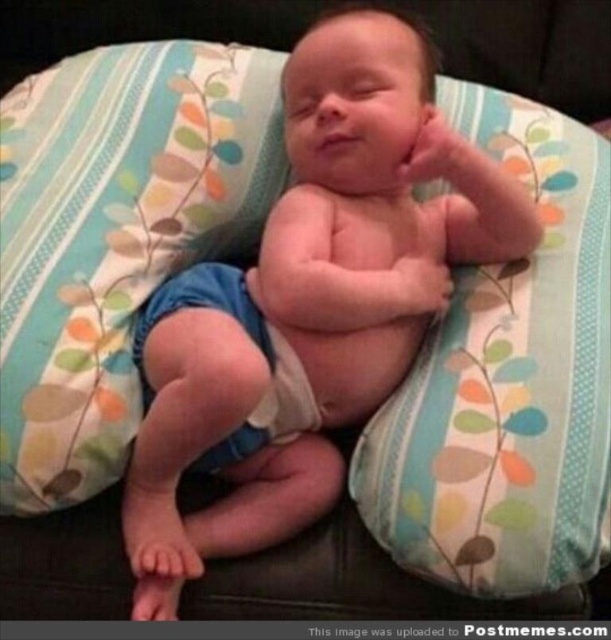
Can you confirm if smooth skin baby at center is smaller than blue fabric diaper at center?

No.

Is smooth skin baby at center wider than blue fabric diaper at center?

Correct, the width of smooth skin baby at center exceeds that of blue fabric diaper at center.

Is point (137, 552) farther from viewer compared to point (290, 356)?

That is False.

The width and height of the screenshot is (611, 640). I want to click on smooth skin baby at center, so click(309, 301).

Can you confirm if smooth skin baby at center is shorter than blue fabric pillow at center?

No.

Who is taller, smooth skin baby at center or blue fabric pillow at center?

Standing taller between the two is smooth skin baby at center.

At what (x,y) coordinates should I click in order to perform the action: click on smooth skin baby at center. Please return your answer as a coordinate pair (x, y). Looking at the image, I should click on (309, 301).

Can you confirm if fluffy fabric pillow at center is positioned to the left of blue fabric diaper at center?

No, fluffy fabric pillow at center is not to the left of blue fabric diaper at center.

Does point (480, 508) come in front of point (147, 317)?

That is True.

Find the location of a particular element. This screenshot has height=640, width=611. fluffy fabric pillow at center is located at coordinates (507, 384).